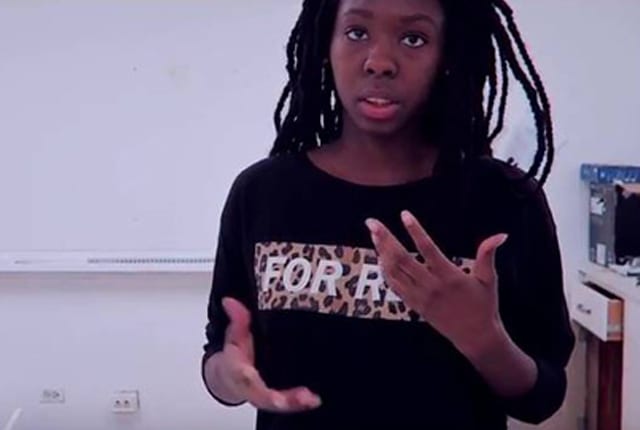
Find the location of `drawer handle`. drawer handle is located at coordinates (580, 309).